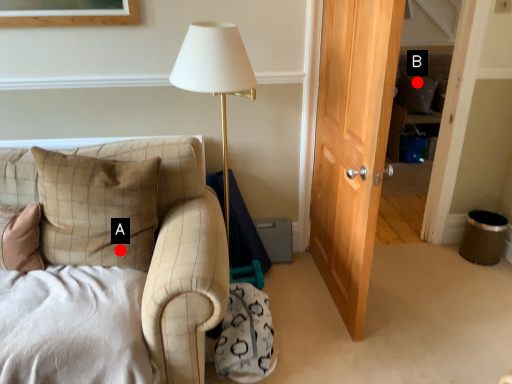
Question: Two points are circled on the image, labeled by A and B beside each circle. Among these points, which one is farthest from the camera?

Choices:
 (A) A is further
 (B) B is further

Answer: (B)